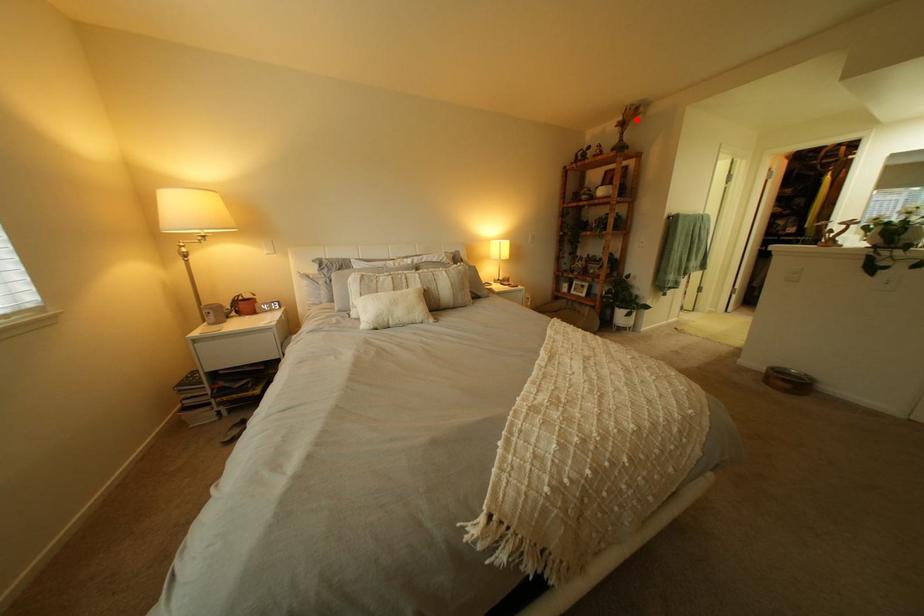
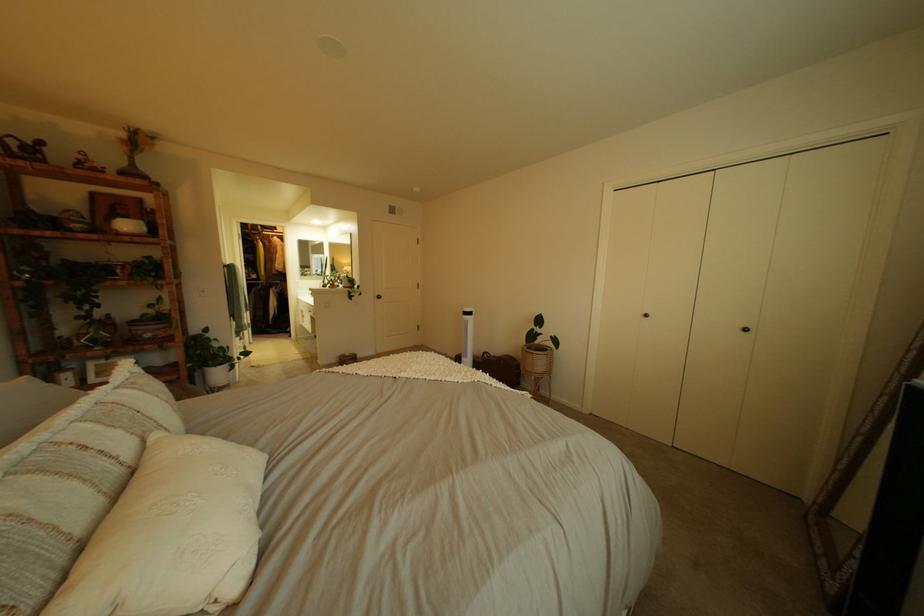
Where in the second image is the point corresponding to the highlighted location from the first image?

(139, 137)